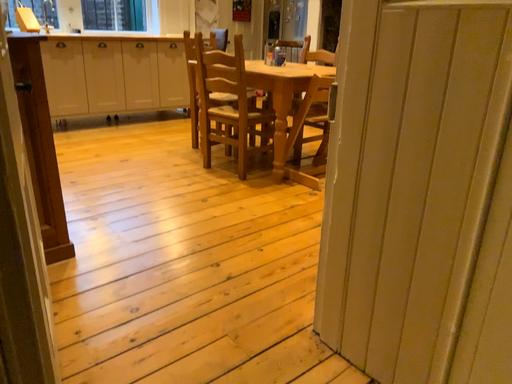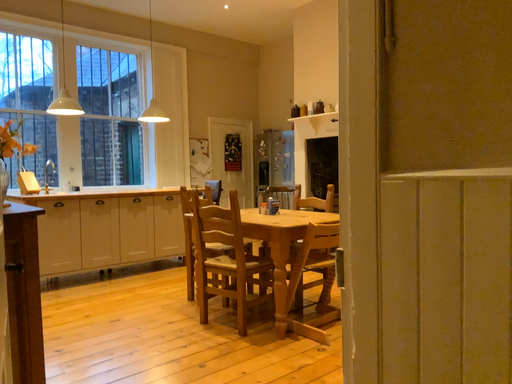
Question: Which way did the camera rotate in the video?

Choices:
 (A) rotated downward
 (B) rotated upward

Answer: (B)